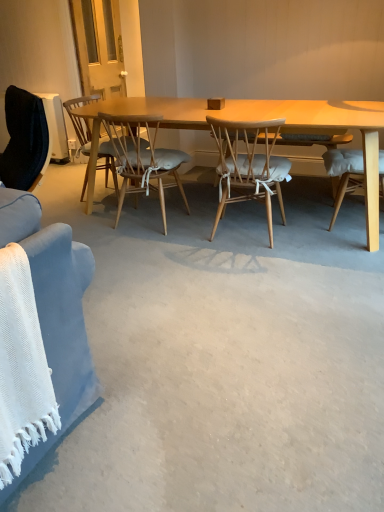
Find the location of a particular element. The height and width of the screenshot is (512, 384). vacant area on the back side of light brown wood chair at center, the second chair in the right-to-left sequence is located at coordinates (163, 200).